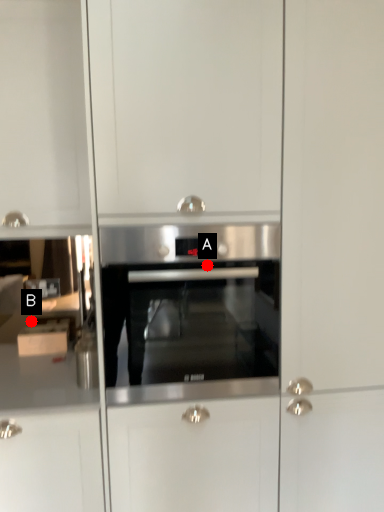
Question: Two points are circled on the image, labeled by A and B beside each circle. Among these points, which one is nearest to the camera?

Choices:
 (A) A is closer
 (B) B is closer

Answer: (A)